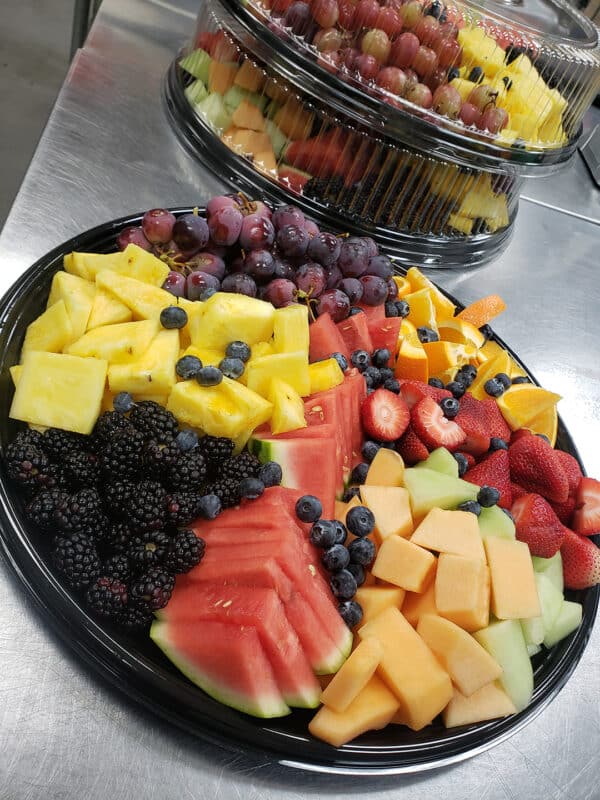
Where is `table`? table is located at coordinates (68, 740), (554, 206).